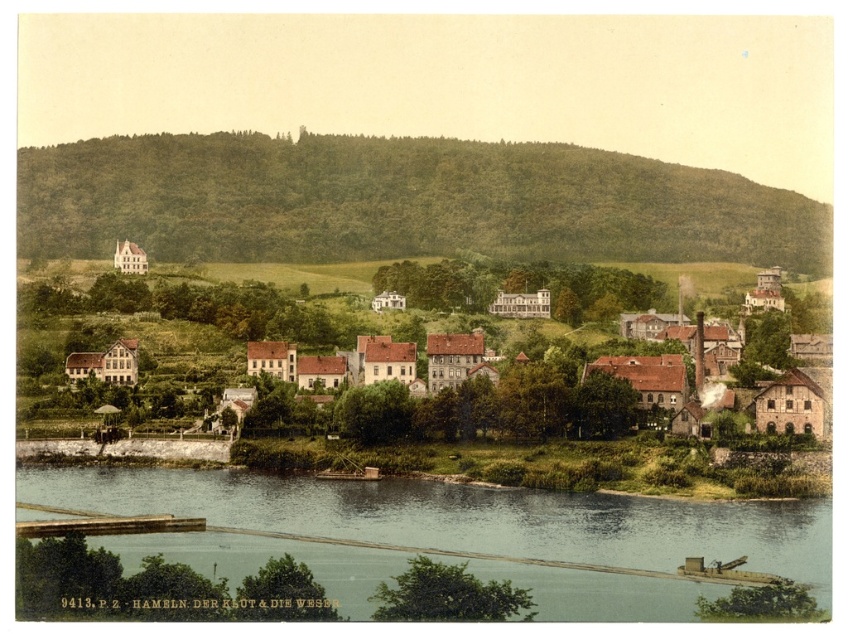
Which is more to the right, green textured hillside at upper center or clear water at lower center?

From the viewer's perspective, green textured hillside at upper center appears more on the right side.

The height and width of the screenshot is (640, 848). Describe the element at coordinates (400, 202) in the screenshot. I see `green textured hillside at upper center` at that location.

The image size is (848, 640). Identify the location of green textured hillside at upper center. (400, 202).

Does green textured hillside at upper center have a greater height compared to brown wooden houses at center?

Indeed, green textured hillside at upper center has a greater height compared to brown wooden houses at center.

Between point (537, 228) and point (793, 413), which one is positioned behind?

Point (537, 228)

Identify the location of green textured hillside at upper center. (400, 202).

Does clear water at lower center have a larger size compared to brown wooden houses at center?

No.

Can you confirm if clear water at lower center is wider than brown wooden houses at center?

No, clear water at lower center is not wider than brown wooden houses at center.

Who is more forward, (x=310, y=492) or (x=622, y=362)?

Point (x=310, y=492) is more forward.

I want to click on clear water at lower center, so click(452, 534).